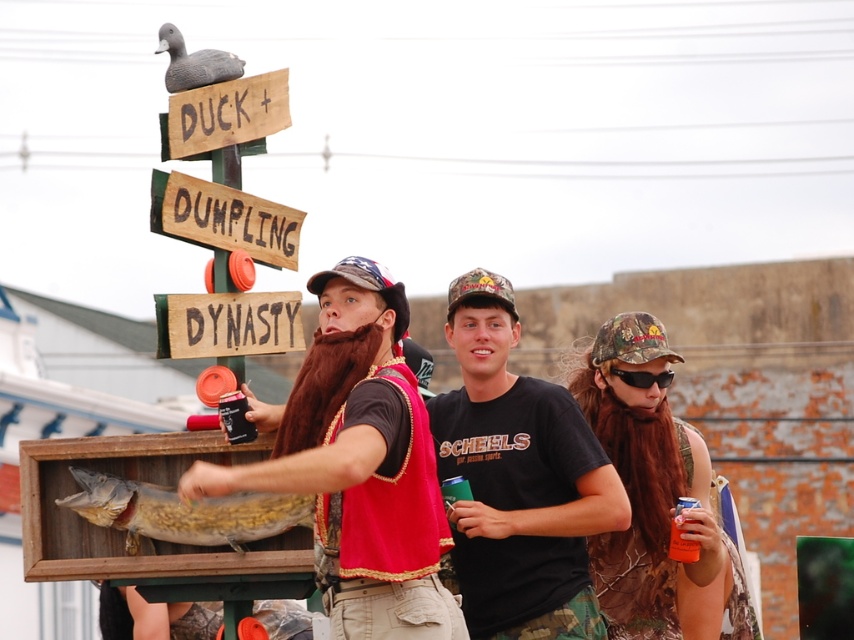
Is wooden sign at center bigger than american flag fabric baseball cap at center?

No.

What do you see at coordinates (224, 218) in the screenshot? I see `wooden sign at center` at bounding box center [224, 218].

Where is `wooden sign at center`? wooden sign at center is located at coordinates (224, 218).

How distant is wooden signboard at center from american flag fabric baseball cap at center?

The distance of wooden signboard at center from american flag fabric baseball cap at center is 4.57 meters.

Between wooden signboard at center and american flag fabric baseball cap at center, which one is positioned lower?

wooden signboard at center is lower down.

Which is in front, point (275, 352) or point (402, 328)?

Positioned in front is point (402, 328).

Find the location of a particular element. The image size is (854, 640). wooden signboard at center is located at coordinates (227, 323).

Does wooden sign at center appear on the right side of wooden sign at upper center?

Incorrect, wooden sign at center is not on the right side of wooden sign at upper center.

Where is `wooden sign at center`? wooden sign at center is located at coordinates (224, 218).